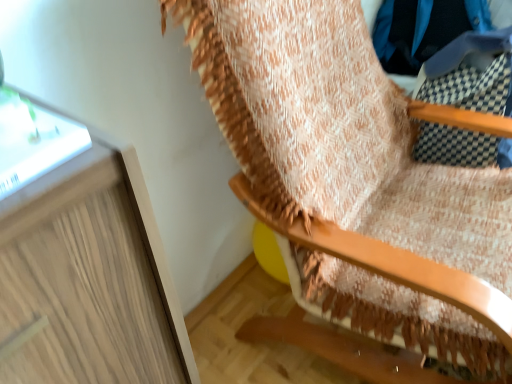
Question: Considering the relative sizes of wooden rocking chair at upper right and blue fabric at upper right in the image provided, is wooden rocking chair at upper right thinner than blue fabric at upper right?

Choices:
 (A) no
 (B) yes

Answer: (A)

Question: Can you confirm if wooden rocking chair at upper right is positioned to the left of blue fabric at upper right?

Choices:
 (A) no
 (B) yes

Answer: (B)

Question: From the image's perspective, is wooden rocking chair at upper right located beneath blue fabric at upper right?

Choices:
 (A) yes
 (B) no

Answer: (A)

Question: From a real-world perspective, is wooden rocking chair at upper right beneath blue fabric at upper right?

Choices:
 (A) yes
 (B) no

Answer: (A)

Question: Considering the relative sizes of wooden rocking chair at upper right and blue fabric at upper right in the image provided, is wooden rocking chair at upper right wider than blue fabric at upper right?

Choices:
 (A) yes
 (B) no

Answer: (A)

Question: Does wooden rocking chair at upper right have a larger size compared to blue fabric at upper right?

Choices:
 (A) yes
 (B) no

Answer: (A)

Question: Could you tell me if blue fabric at upper right is turned towards wooden rocking chair at upper right?

Choices:
 (A) yes
 (B) no

Answer: (B)

Question: Is blue fabric at upper right to the left of wooden rocking chair at upper right from the viewer's perspective?

Choices:
 (A) no
 (B) yes

Answer: (A)

Question: Can you confirm if blue fabric at upper right is taller than wooden rocking chair at upper right?

Choices:
 (A) no
 (B) yes

Answer: (A)

Question: Does blue fabric at upper right lie behind wooden rocking chair at upper right?

Choices:
 (A) yes
 (B) no

Answer: (A)

Question: Is blue fabric at upper right touching wooden rocking chair at upper right?

Choices:
 (A) no
 (B) yes

Answer: (A)

Question: Is blue fabric at upper right not inside wooden rocking chair at upper right?

Choices:
 (A) no
 (B) yes

Answer: (B)

Question: Choose the correct answer: Is blue fabric at upper right inside wooden rocking chair at upper right or outside it?

Choices:
 (A) inside
 (B) outside

Answer: (B)